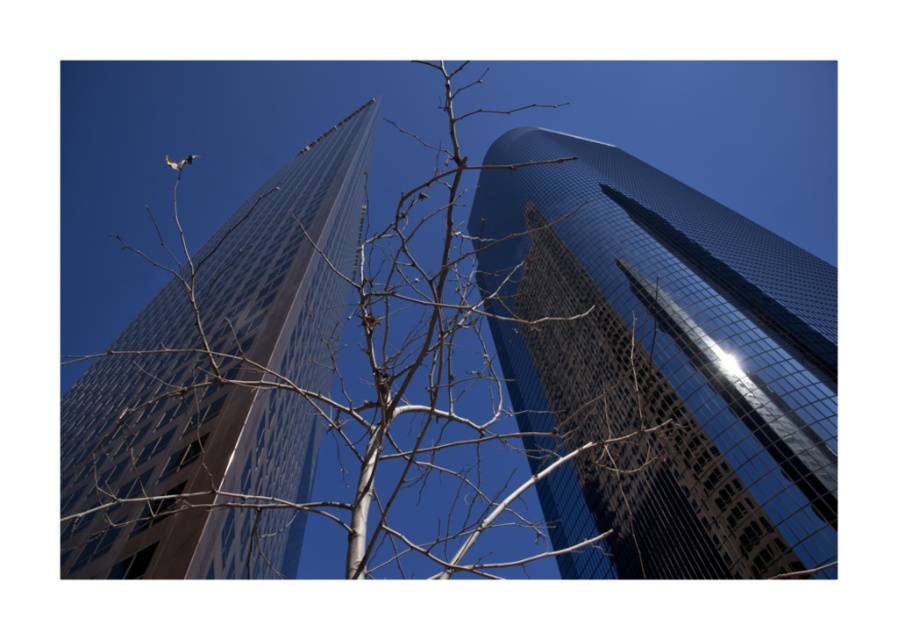
Is bare branches at center below glossy glass tower at left?

Indeed, bare branches at center is positioned under glossy glass tower at left.

Which is behind, point (536, 435) or point (313, 445)?

Positioned behind is point (313, 445).

Who is more distant from viewer, (169, 353) or (301, 532)?

Positioned behind is point (301, 532).

Where is `bare branches at center`? The height and width of the screenshot is (640, 898). bare branches at center is located at coordinates (307, 385).

Can you confirm if bare branches at center is shorter than glossy glass skyscraper at center?

No.

Does bare branches at center lie in front of glossy glass skyscraper at center?

Yes, bare branches at center is closer to the viewer.

Where is `bare branches at center`? Image resolution: width=898 pixels, height=640 pixels. bare branches at center is located at coordinates (307, 385).

Who is higher up, glossy glass skyscraper at center or glossy glass tower at left?

glossy glass tower at left

Describe the element at coordinates (662, 364) in the screenshot. I see `glossy glass skyscraper at center` at that location.

The image size is (898, 640). What are the coordinates of `glossy glass skyscraper at center` in the screenshot? It's located at (662, 364).